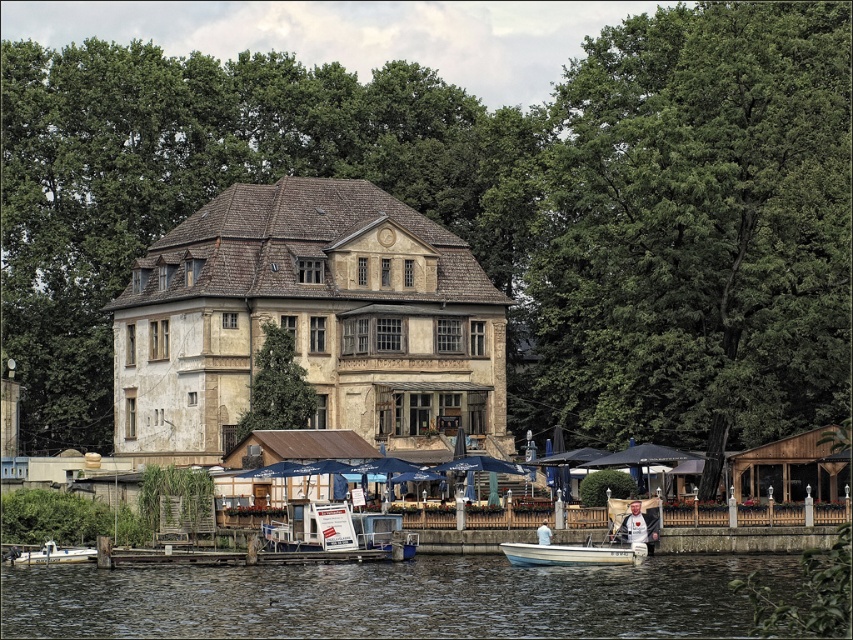
Question: Which point is closer to the camera?

Choices:
 (A) (80, 618)
 (B) (634, 522)
 (C) (96, 556)
 (D) (518, 561)

Answer: (A)

Question: Does white plastic boat at lower left appear on the left side of white cotton shirt at lower center?

Choices:
 (A) no
 (B) yes

Answer: (B)

Question: Among these points, which one is nearest to the camera?

Choices:
 (A) (491, 600)
 (B) (82, 547)

Answer: (A)

Question: Is dark green water at lower center to the left of white matte boat at lower center from the viewer's perspective?

Choices:
 (A) no
 (B) yes

Answer: (B)

Question: Is dark green water at lower center wider than white cotton shirt at lower center?

Choices:
 (A) no
 (B) yes

Answer: (B)

Question: Which of the following is the closest to the observer?

Choices:
 (A) white plastic boat at lower left
 (B) white matte boat at lower center
 (C) white fabric shirt at lower center

Answer: (B)